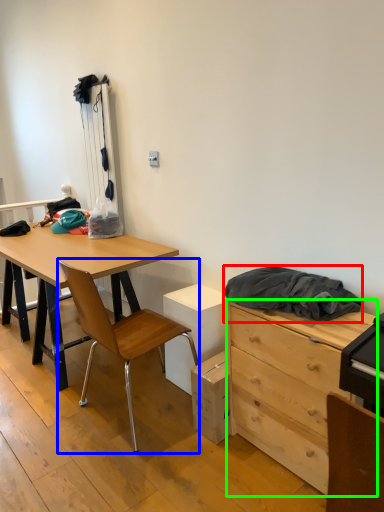
Question: Based on their relative distances, which object is nearer to clothing (highlighted by a red box)? Choose from chair (highlighted by a blue box) and chest of drawers (highlighted by a green box).

Choices:
 (A) chair
 (B) chest of drawers

Answer: (B)